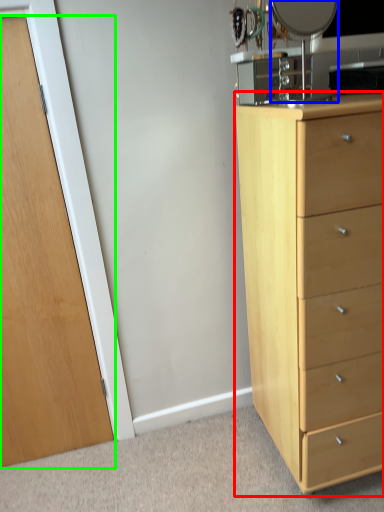
Question: Which object is positioned farthest from chest of drawers (highlighted by a red box)? Select from mirror (highlighted by a blue box) and door (highlighted by a green box).

Choices:
 (A) mirror
 (B) door

Answer: (B)